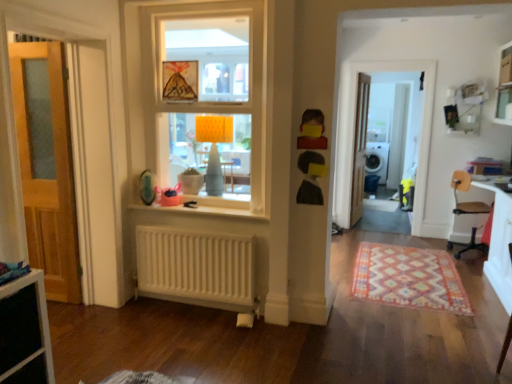
The width and height of the screenshot is (512, 384). What are the coordinates of `free spot above white glossy window sill at center (from a real-world perspective)` in the screenshot? It's located at (206, 205).